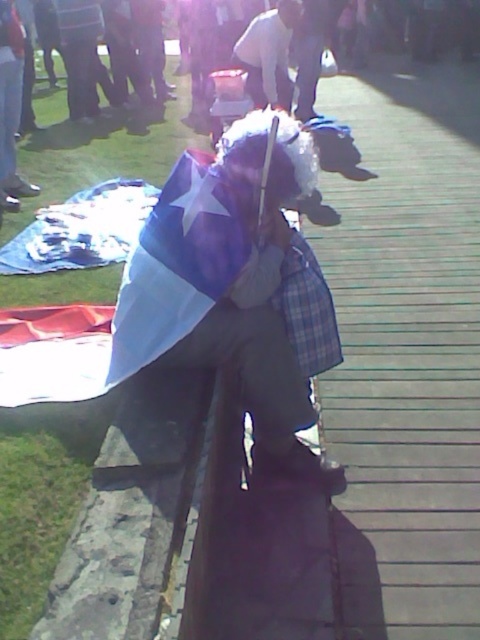
Question: Is the position of blue fabric flag at center less distant than that of white fabric flag at center?

Choices:
 (A) no
 (B) yes

Answer: (B)

Question: Considering the real-world distances, which object is farthest from the white cotton shirt at center?

Choices:
 (A) white fabric flag at center
 (B) blue fabric flag at center

Answer: (B)

Question: Can you confirm if blue fabric flag at center is positioned above white cotton shirt at center?

Choices:
 (A) yes
 (B) no

Answer: (B)

Question: Is blue fabric flag at center smaller than white cotton shirt at center?

Choices:
 (A) yes
 (B) no

Answer: (A)

Question: Considering the real-world distances, which object is farthest from the white fabric flag at center?

Choices:
 (A) blue fabric flag at center
 (B) white cotton shirt at center

Answer: (B)

Question: Considering the real-world distances, which object is closest to the white cotton shirt at center?

Choices:
 (A) blue fabric flag at center
 (B) white fabric flag at center

Answer: (B)